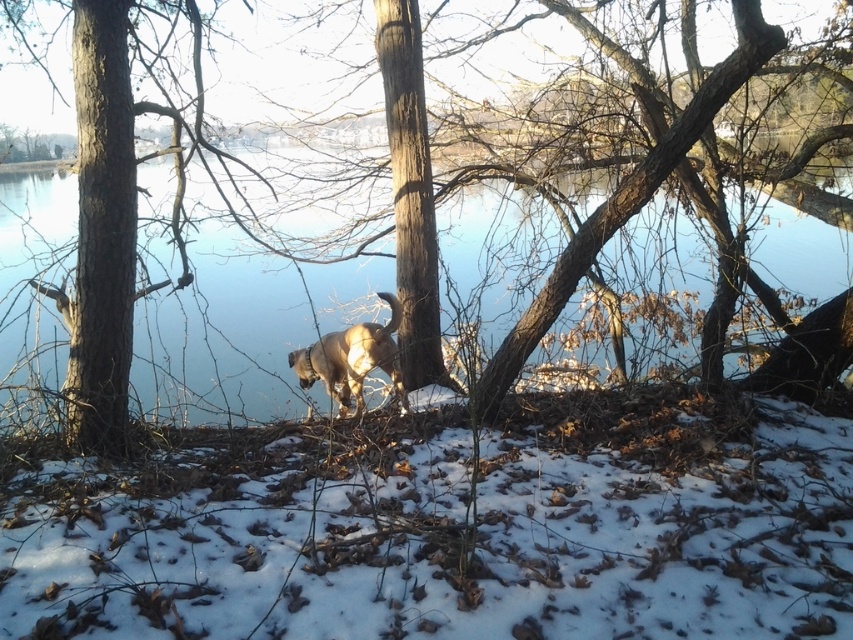
Does point (86, 141) lie in front of point (343, 406)?

That is True.

Image resolution: width=853 pixels, height=640 pixels. What do you see at coordinates (103, 227) in the screenshot? I see `brown rough tree at center` at bounding box center [103, 227].

Based on the photo, who is more forward, (97, 401) or (345, 352)?

Result: Point (97, 401) is more forward.

The height and width of the screenshot is (640, 853). I want to click on brown rough tree at center, so tap(103, 227).

Between white fluffy snow at lower center and fuzzy brown dog at center, which one has less height?

Standing shorter between the two is white fluffy snow at lower center.

Does white fluffy snow at lower center have a greater height compared to fuzzy brown dog at center?

No, white fluffy snow at lower center is not taller than fuzzy brown dog at center.

Who is more forward, (494, 604) or (311, 376)?

Point (494, 604) is in front.

In order to click on white fluffy snow at lower center in this screenshot , I will do `click(445, 525)`.

Does white fluffy snow at lower center have a larger size compared to clear blue water at center?

Correct, white fluffy snow at lower center is larger in size than clear blue water at center.

Between white fluffy snow at lower center and clear blue water at center, which one appears on the left side from the viewer's perspective?

white fluffy snow at lower center

Who is more forward, [784,449] or [252,314]?

Point [784,449] is in front.

Locate an element on the screen. white fluffy snow at lower center is located at coordinates (445, 525).